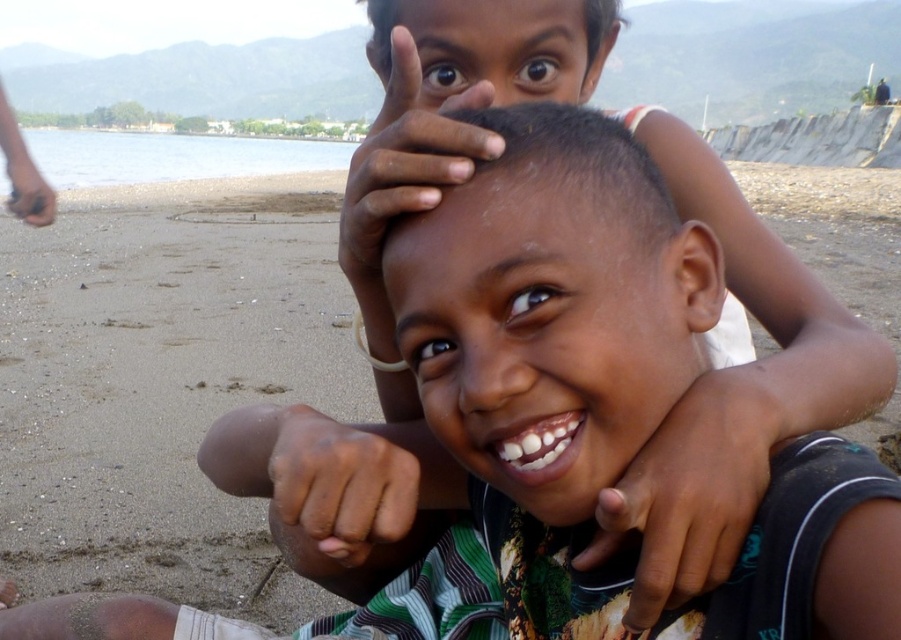
Question: Does dry skin at upper center come behind brown skin hand at lower left?

Choices:
 (A) yes
 (B) no

Answer: (B)

Question: Which point appears closest to the camera in this image?

Choices:
 (A) (29, 193)
 (B) (379, 147)
 (C) (371, 432)
 (D) (662, 500)

Answer: (D)

Question: Is dry skin at upper center below dark skin/flesh colored hand at lower center?

Choices:
 (A) no
 (B) yes

Answer: (A)

Question: Among these objects, which one is farthest from the camera?

Choices:
 (A) dry skin at upper center
 (B) brown skin hand at lower left
 (C) dark skin hand at center
 (D) dark skin/flesh colored hand at lower center

Answer: (B)

Question: Which of the following is the closest to the observer?

Choices:
 (A) (438, 195)
 (B) (324, 419)

Answer: (A)

Question: Can you confirm if dry skin at upper center is positioned below brown skin hand at lower left?

Choices:
 (A) yes
 (B) no

Answer: (A)